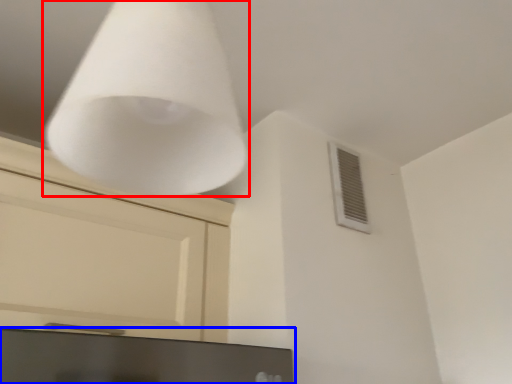
Question: Which object appears farthest to the camera in this image, lamp (highlighted by a red box) or computer monitor (highlighted by a blue box)?

Choices:
 (A) lamp
 (B) computer monitor

Answer: (B)